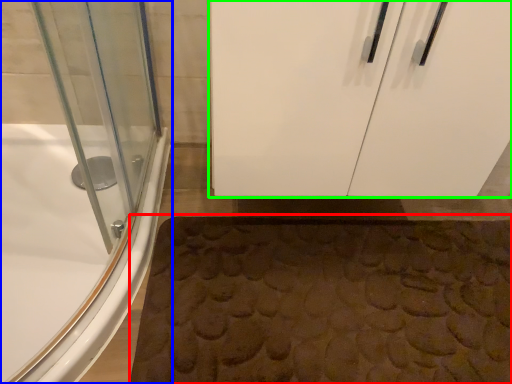
Question: Based on their relative distances, which object is farther from bath mat (highlighted by a red box)? Choose from bathtub (highlighted by a blue box) and door (highlighted by a green box).

Choices:
 (A) bathtub
 (B) door

Answer: (A)